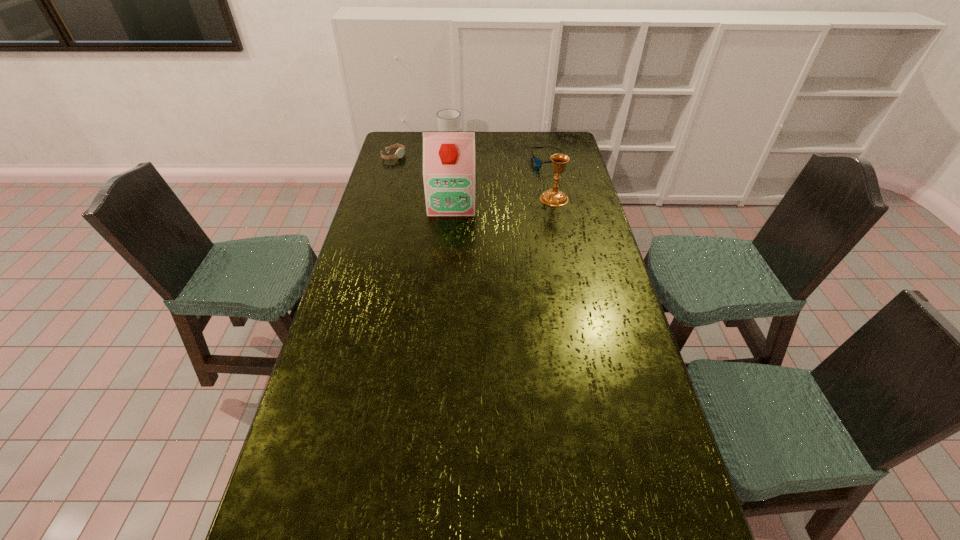
At what (x,y) coordinates should I click in order to perform the action: click on free space that satisfies the following two spatial constraints: 1. on the back side of the shortest object; 2. on the left side of the chalice. Please return your answer as a coordinate pair (x, y). Looking at the image, I should click on (546, 163).

Find the location of a particular element. This screenshot has height=540, width=960. vacant space that satisfies the following two spatial constraints: 1. on the front side of the chalice; 2. on the right side of the cup is located at coordinates (444, 198).

This screenshot has height=540, width=960. Find the location of `vacant region that satisfies the following two spatial constraints: 1. on the back side of the leftmost object; 2. on the right side of the third shortest object`. vacant region that satisfies the following two spatial constraints: 1. on the back side of the leftmost object; 2. on the right side of the third shortest object is located at coordinates (397, 144).